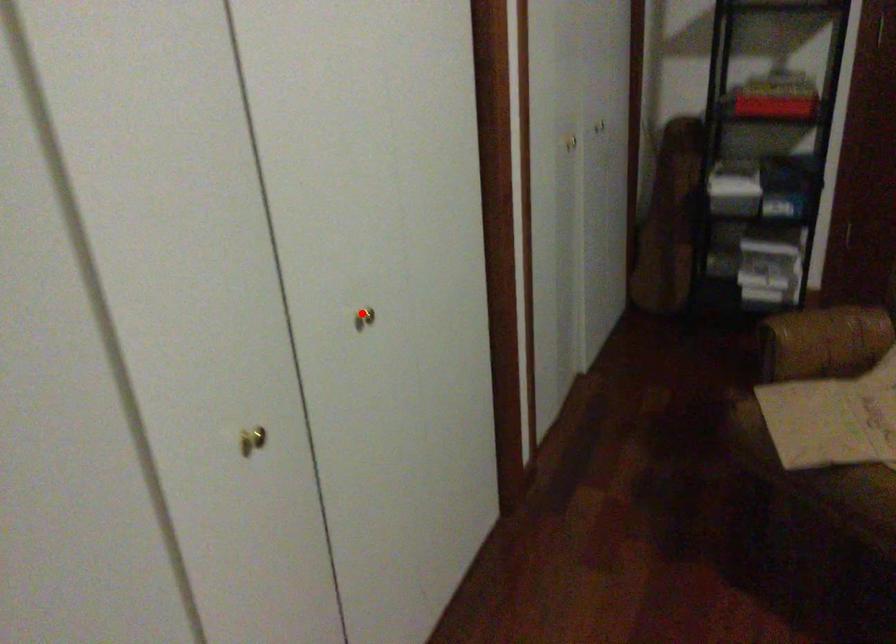
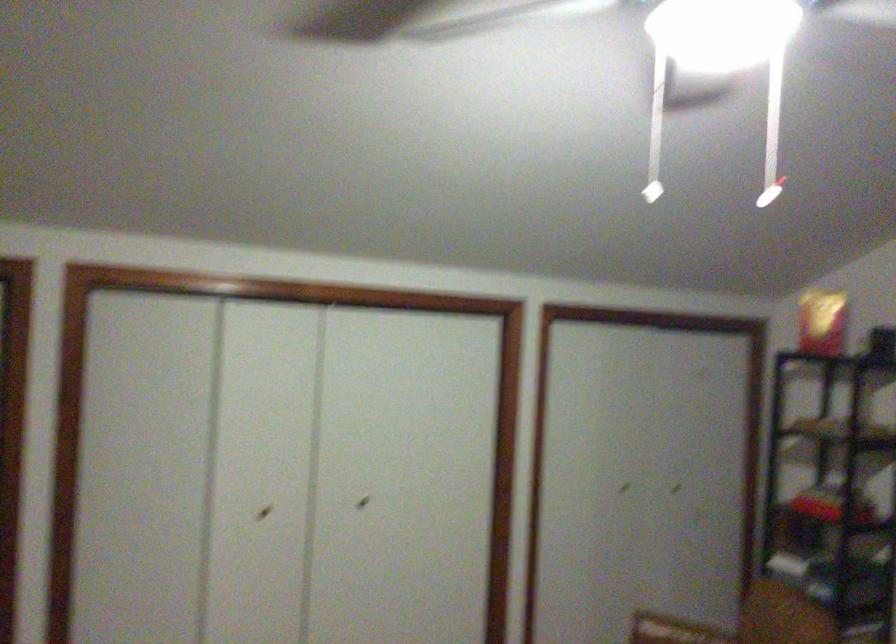
Question: I am providing you with two images of the same scene from different viewpoints. Given a red point in image1, look at the same physical point in image2. Is it:

Choices:
 (A) Closer to the viewpoint
 (B) Farther from the viewpoint

Answer: (B)